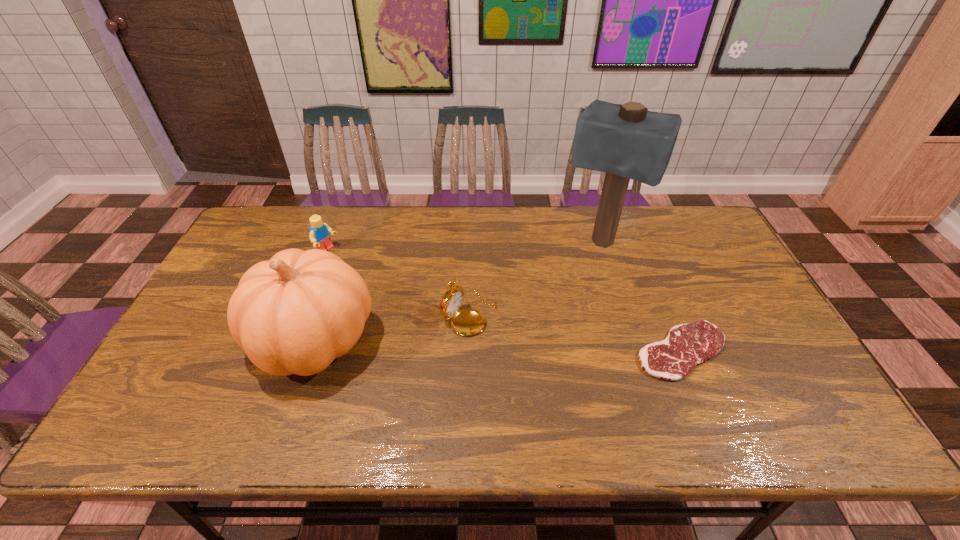
This screenshot has width=960, height=540. Identify the location of pumpkin. (293, 314).

What are the coordinates of `the shortest object` in the screenshot? It's located at (686, 345).

Where is `mallet`? Image resolution: width=960 pixels, height=540 pixels. mallet is located at coordinates (627, 141).

The height and width of the screenshot is (540, 960). I want to click on Lego, so click(319, 235).

The image size is (960, 540). Identify the location of pocket watch. (467, 322).

Where is `vacant space located on the right of the second tallest object`? vacant space located on the right of the second tallest object is located at coordinates (490, 340).

This screenshot has width=960, height=540. I want to click on vacant point located on the right of the shortest object, so click(x=749, y=350).

Identify the location of vacant region located on the striking surface of the mallet. (560, 317).

I want to click on vacant area located on the striking surface of the mallet, so click(x=548, y=340).

This screenshot has height=540, width=960. In order to click on blank area located on the striking surface of the mallet in this screenshot , I will do `click(560, 317)`.